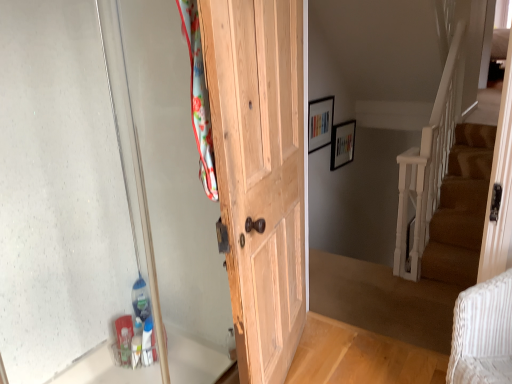
Question: Which direction should I rotate to face wooden picture frame at upper center, arranged as the first picture frame when viewed from the back, — up or down?

Choices:
 (A) up
 (B) down

Answer: (A)

Question: From the image's perspective, is natural wood door at center under wooden picture frame at upper center, the 2th picture frame viewed from the left?

Choices:
 (A) no
 (B) yes

Answer: (B)

Question: From a real-world perspective, is natural wood door at center under wooden picture frame at upper center, placed as the 1th picture frame when sorted from right to left?

Choices:
 (A) no
 (B) yes

Answer: (A)

Question: From a real-world perspective, is natural wood door at center on top of wooden picture frame at upper center, the 2th picture frame viewed from the left?

Choices:
 (A) no
 (B) yes

Answer: (B)

Question: Is wooden picture frame at upper center, placed as the 1th picture frame when sorted from right to left, a part of natural wood door at center?

Choices:
 (A) no
 (B) yes

Answer: (A)

Question: Does natural wood door at center have a smaller size compared to wooden picture frame at upper center, which is counted as the 2th picture frame, starting from the front?

Choices:
 (A) yes
 (B) no

Answer: (B)

Question: Is natural wood door at center wider than wooden picture frame at upper center, which is counted as the 2th picture frame, starting from the front?

Choices:
 (A) no
 (B) yes

Answer: (B)

Question: Considering the relative positions of transparent glass door at left and wooden picture frame at upper center, which is counted as the 2th picture frame, starting from the front, in the image provided, is transparent glass door at left behind wooden picture frame at upper center, which is counted as the 2th picture frame, starting from the front,?

Choices:
 (A) no
 (B) yes

Answer: (A)

Question: Could you tell me if transparent glass door at left is facing wooden picture frame at upper center, the 2th picture frame viewed from the left?

Choices:
 (A) no
 (B) yes

Answer: (A)

Question: From a real-world perspective, is transparent glass door at left physically below wooden picture frame at upper center, placed as the 1th picture frame when sorted from right to left?

Choices:
 (A) yes
 (B) no

Answer: (B)

Question: Would you say transparent glass door at left is outside wooden picture frame at upper center, the 2th picture frame viewed from the left?

Choices:
 (A) no
 (B) yes

Answer: (B)

Question: Is transparent glass door at left facing away from wooden picture frame at upper center, which is counted as the 2th picture frame, starting from the front?

Choices:
 (A) yes
 (B) no

Answer: (B)

Question: Is transparent glass door at left taller than wooden picture frame at upper center, which is counted as the 2th picture frame, starting from the front?

Choices:
 (A) yes
 (B) no

Answer: (A)

Question: Does natural wood door at center appear on the right side of wooden picture frame at upper center, the second picture frame positioned from the back?

Choices:
 (A) no
 (B) yes

Answer: (A)